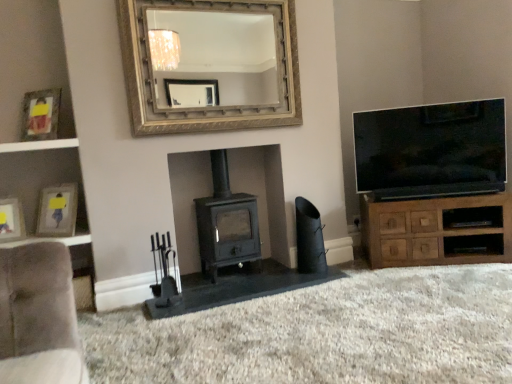
Question: Can you confirm if matte black wood burning stove at center is shorter than matte gold picture frame at upper left, the third picture frame in the bottom-to-top sequence?

Choices:
 (A) no
 (B) yes

Answer: (A)

Question: From a real-world perspective, is matte black wood burning stove at center located higher than matte gold picture frame at upper left, placed as the first picture frame when sorted from top to bottom?

Choices:
 (A) no
 (B) yes

Answer: (A)

Question: Does matte black wood burning stove at center appear on the right side of matte gold picture frame at upper left, the third picture frame in the bottom-to-top sequence?

Choices:
 (A) no
 (B) yes

Answer: (B)

Question: Does matte black wood burning stove at center turn towards matte gold picture frame at upper left, the third picture frame in the bottom-to-top sequence?

Choices:
 (A) yes
 (B) no

Answer: (B)

Question: From a real-world perspective, is matte black wood burning stove at center located beneath matte gold picture frame at upper left, the third picture frame in the bottom-to-top sequence?

Choices:
 (A) no
 (B) yes

Answer: (B)

Question: Looking at their shapes, would you say flat-screen tv at right is wider or thinner than black matte speaker at lower right?

Choices:
 (A) wide
 (B) thin

Answer: (B)

Question: In the image, is flat-screen tv at right positioned in front of or behind black matte speaker at lower right?

Choices:
 (A) front
 (B) behind

Answer: (B)

Question: Does point (368, 178) appear closer or farther from the camera than point (298, 248)?

Choices:
 (A) farther
 (B) closer

Answer: (A)

Question: Visually, is flat-screen tv at right positioned to the left or to the right of black matte speaker at lower right?

Choices:
 (A) right
 (B) left

Answer: (A)

Question: In terms of height, does brown wood cabinet at right look taller or shorter compared to black matte speaker at lower right?

Choices:
 (A) short
 (B) tall

Answer: (A)

Question: Considering their positions, is brown wood cabinet at right located in front of or behind black matte speaker at lower right?

Choices:
 (A) behind
 (B) front

Answer: (B)

Question: From a real-world perspective, is brown wood cabinet at right positioned above or below black matte speaker at lower right?

Choices:
 (A) above
 (B) below

Answer: (B)

Question: Is brown wood cabinet at right to the left or to the right of black matte speaker at lower right in the image?

Choices:
 (A) right
 (B) left

Answer: (A)

Question: In the image, is white glossy shelf at left on the left side or the right side of matte gold picture frame at upper left, placed as the first picture frame when sorted from top to bottom?

Choices:
 (A) left
 (B) right

Answer: (A)

Question: Is white glossy shelf at left in front of or behind matte gold picture frame at upper left, placed as the first picture frame when sorted from top to bottom, in the image?

Choices:
 (A) front
 (B) behind

Answer: (A)